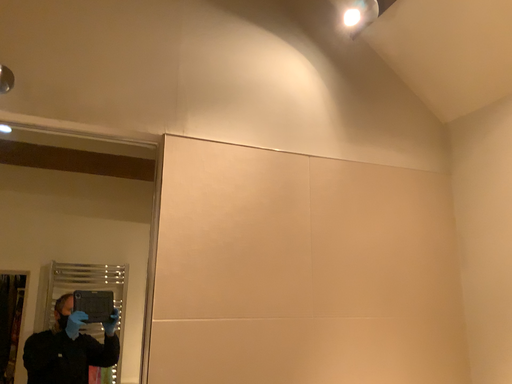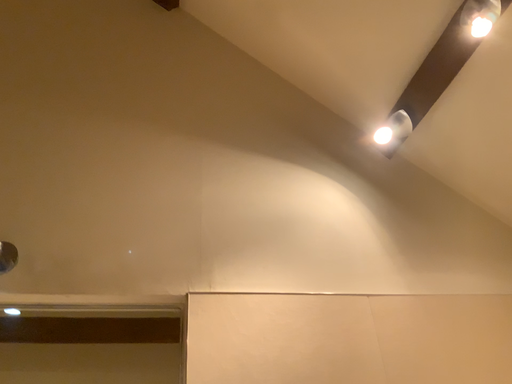
Question: Which way did the camera rotate in the video?

Choices:
 (A) rotated upward
 (B) rotated downward

Answer: (A)